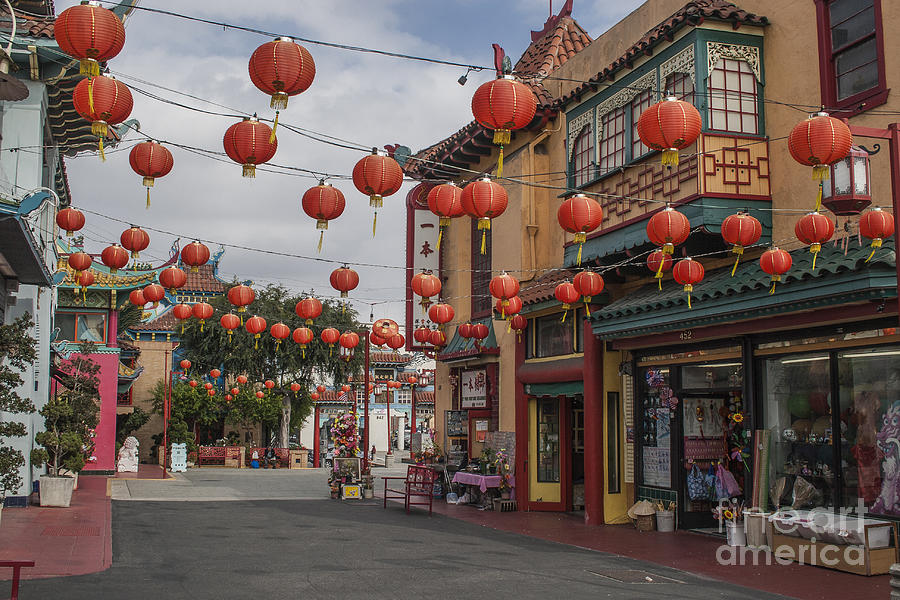
The image size is (900, 600). Find the location of `tassle`. tassle is located at coordinates (509, 155).